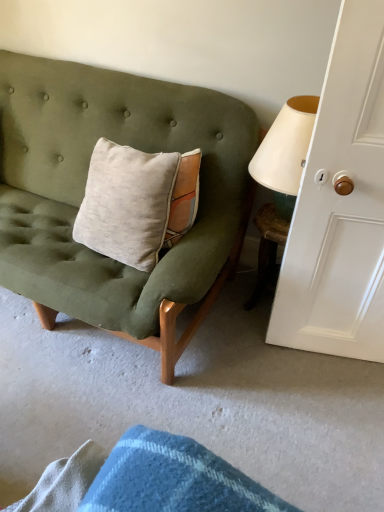
Question: Is the depth of wooden table at lower right less than that of matte green fabric couch at left?

Choices:
 (A) no
 (B) yes

Answer: (A)

Question: From the image's perspective, is wooden table at lower right located above matte green fabric couch at left?

Choices:
 (A) no
 (B) yes

Answer: (A)

Question: Is wooden table at lower right to the left of matte green fabric couch at left from the viewer's perspective?

Choices:
 (A) yes
 (B) no

Answer: (B)

Question: Is wooden table at lower right further to the viewer compared to matte green fabric couch at left?

Choices:
 (A) yes
 (B) no

Answer: (A)

Question: Is wooden table at lower right directly adjacent to matte green fabric couch at left?

Choices:
 (A) yes
 (B) no

Answer: (B)

Question: Considering their positions, is matte green fabric couch at left located in front of or behind white painted wood door at right?

Choices:
 (A) behind
 (B) front

Answer: (A)

Question: Considering the positions of matte green fabric couch at left and white painted wood door at right in the image, is matte green fabric couch at left wider or thinner than white painted wood door at right?

Choices:
 (A) thin
 (B) wide

Answer: (B)

Question: Which is correct: matte green fabric couch at left is inside white painted wood door at right, or outside of it?

Choices:
 (A) inside
 (B) outside

Answer: (B)

Question: Considering the positions of matte green fabric couch at left and white painted wood door at right in the image, is matte green fabric couch at left taller or shorter than white painted wood door at right?

Choices:
 (A) short
 (B) tall

Answer: (A)

Question: Is point (342, 88) closer or farther from the camera than point (168, 97)?

Choices:
 (A) farther
 (B) closer

Answer: (B)

Question: From their relative heights in the image, would you say white painted wood door at right is taller or shorter than matte green fabric couch at left?

Choices:
 (A) tall
 (B) short

Answer: (A)

Question: Is white painted wood door at right inside or outside of matte green fabric couch at left?

Choices:
 (A) inside
 (B) outside

Answer: (B)

Question: Visually, is white painted wood door at right positioned to the left or to the right of matte green fabric couch at left?

Choices:
 (A) left
 (B) right

Answer: (B)

Question: Based on their positions, is white painted wood door at right located to the left or right of wooden table at lower right?

Choices:
 (A) left
 (B) right

Answer: (B)

Question: Is point (294, 332) positioned closer to the camera than point (269, 245)?

Choices:
 (A) closer
 (B) farther

Answer: (A)